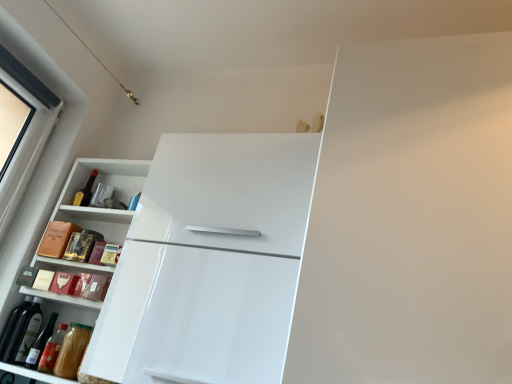
Question: Is white glossy refrigerator at upper center to the right of green glass wine bottle at lower left from the viewer's perspective?

Choices:
 (A) yes
 (B) no

Answer: (A)

Question: Is white glossy refrigerator at upper center oriented away from green glass wine bottle at lower left?

Choices:
 (A) no
 (B) yes

Answer: (A)

Question: Is white glossy refrigerator at upper center at the left side of green glass wine bottle at lower left?

Choices:
 (A) yes
 (B) no

Answer: (B)

Question: From a real-world perspective, is white glossy refrigerator at upper center located higher than green glass wine bottle at lower left?

Choices:
 (A) yes
 (B) no

Answer: (A)

Question: Considering the relative sizes of white glossy refrigerator at upper center and green glass wine bottle at lower left in the image provided, is white glossy refrigerator at upper center wider than green glass wine bottle at lower left?

Choices:
 (A) no
 (B) yes

Answer: (B)

Question: Is white glossy refrigerator at upper center not close to green glass wine bottle at lower left?

Choices:
 (A) no
 (B) yes

Answer: (A)

Question: Is white glossy refrigerator at upper center thinner than white glossy cabinet at left?

Choices:
 (A) yes
 (B) no

Answer: (B)

Question: From a real-world perspective, is white glossy refrigerator at upper center below white glossy cabinet at left?

Choices:
 (A) no
 (B) yes

Answer: (A)

Question: Does white glossy refrigerator at upper center have a lesser height compared to white glossy cabinet at left?

Choices:
 (A) no
 (B) yes

Answer: (B)

Question: Considering the relative sizes of white glossy refrigerator at upper center and white glossy cabinet at left in the image provided, is white glossy refrigerator at upper center taller than white glossy cabinet at left?

Choices:
 (A) no
 (B) yes

Answer: (A)

Question: Does white glossy refrigerator at upper center come behind white glossy cabinet at left?

Choices:
 (A) no
 (B) yes

Answer: (A)

Question: Can you confirm if white glossy refrigerator at upper center is wider than white glossy cabinet at left?

Choices:
 (A) yes
 (B) no

Answer: (A)

Question: Is green glass wine bottle at lower left in front of white glossy cabinet at left?

Choices:
 (A) no
 (B) yes

Answer: (A)